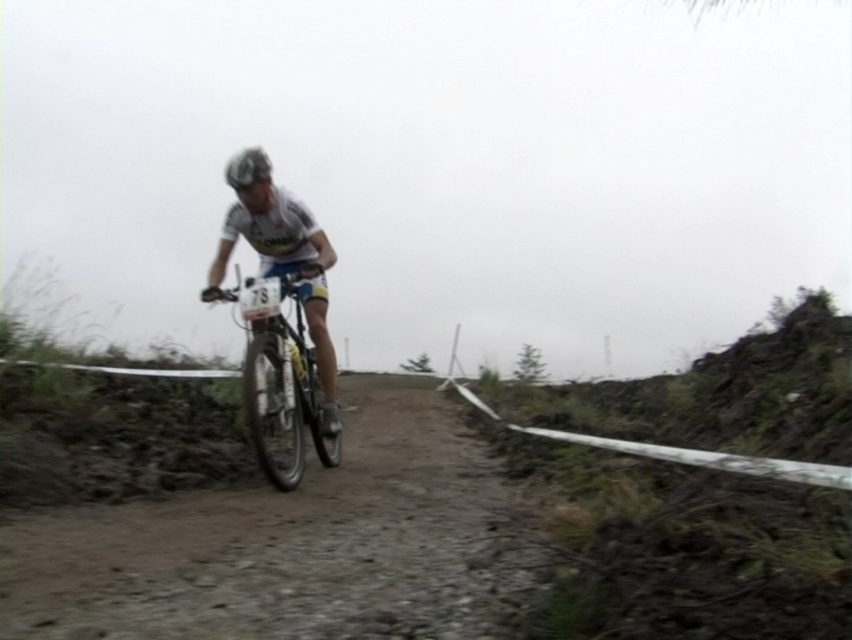
You are a photographer positioned at the starting line of the race. You want to capture a photo of the cyclist while ensuring both the shiny metallic bicycle at center and the shiny silver helmet at center are clearly visible. Given that your camera has a depth of field that can focus on objects within a 1.2 meter range, will both objects be in focus?

The distance between the shiny metallic bicycle at center and the shiny silver helmet at center is 1.16 meters, which is within the camera lens depth of field range of 1.2 meters. Therefore, both objects will be in focus.

You are a photographer positioned at the starting line of the race. You want to capture a photo of the cyclist with both the shiny metallic bicycle at center and the shiny silver helmet at center in focus. Which object should you adjust your camera focus on first to ensure both are sharp?

The shiny metallic bicycle at center is smaller than the shiny silver helmet at center, so you should focus on the shiny silver helmet at center first since it is larger and will be easier to lock focus on.

You are a photographer positioned at point (280, 380). You want to capture a photo of the cyclist wearing a white jersey with the number 78 and their mountain bike with knobby tires. Is the shiny metallic bicycle at center part of the cyclist you should focus on?

Yes, the shiny metallic bicycle at center is part of the cyclist wearing a white jersey with the number 78, as it is their mountain bike with knobby tires.